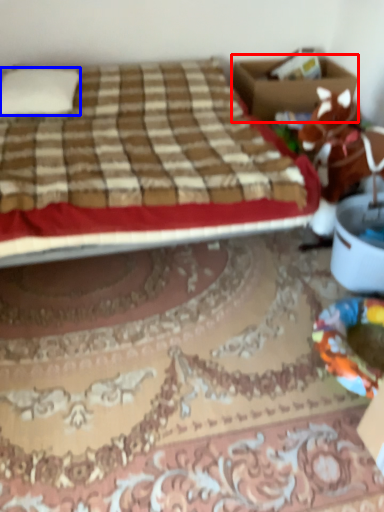
Question: Which point is further to the camera, box (highlighted by a red box) or pillow (highlighted by a blue box)?

Choices:
 (A) box
 (B) pillow

Answer: (A)